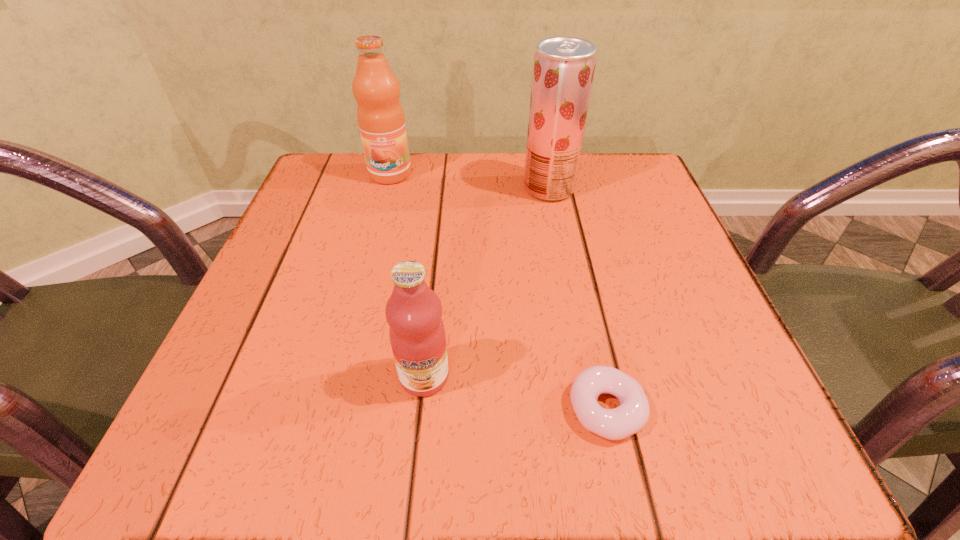
Find the location of a particular element. Image resolution: width=960 pixels, height=540 pixels. the rightmost fruit juice is located at coordinates (563, 68).

The image size is (960, 540). Find the location of `the leftmost object`. the leftmost object is located at coordinates 380,115.

Identify the location of the second object from left to right. (417, 334).

Identify the location of the second fruit juice from left to right. (417, 334).

Find the location of a particular element. The height and width of the screenshot is (540, 960). doughnut is located at coordinates (631, 416).

Identify the location of free space located on the right of the rightmost fruit juice. (612, 188).

Find the location of a particular element. free space located 0.100m on the label side of the leftmost fruit juice is located at coordinates (379, 214).

What are the coordinates of `free space located 0.050m on the label of the nearest fruit juice` in the screenshot? It's located at (419, 435).

Where is `vacant space located 0.070m on the back of the shortest object`? vacant space located 0.070m on the back of the shortest object is located at coordinates 590,336.

Identify the location of object that is at the near edge. This screenshot has height=540, width=960. tap(631, 416).